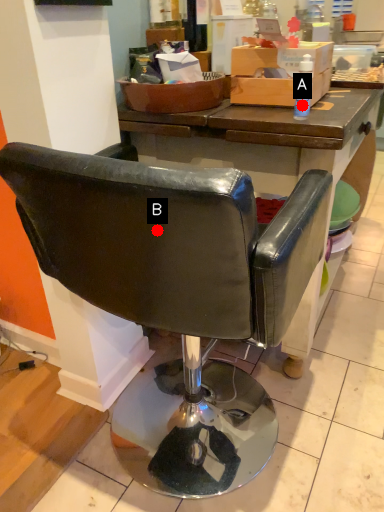
Question: Two points are circled on the image, labeled by A and B beside each circle. Which point is closer to the camera?

Choices:
 (A) A is closer
 (B) B is closer

Answer: (B)